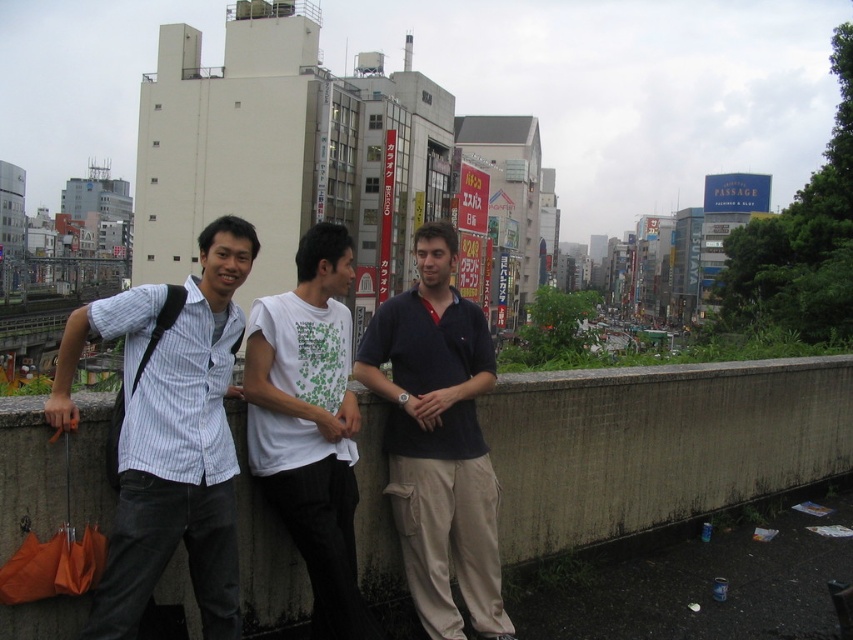
Question: Which object is the farthest from the concrete ledge at center?

Choices:
 (A) dark blue polo shirt at center
 (B) striped cotton shirt at center
 (C) white cotton t-shirt at center

Answer: (B)

Question: Among these points, which one is nearest to the camera?

Choices:
 (A) (653, 380)
 (B) (294, 333)
 (C) (428, 573)
 (D) (222, 400)

Answer: (D)

Question: Which is farther from the white cotton t-shirt at center?

Choices:
 (A) dark blue polo shirt at center
 (B) concrete ledge at center

Answer: (B)

Question: Is concrete ledge at center closer to camera compared to dark blue polo shirt at center?

Choices:
 (A) yes
 (B) no

Answer: (B)

Question: Does concrete ledge at center have a larger size compared to dark blue polo shirt at center?

Choices:
 (A) no
 (B) yes

Answer: (A)

Question: Is striped cotton shirt at center behind white cotton t-shirt at center?

Choices:
 (A) yes
 (B) no

Answer: (B)